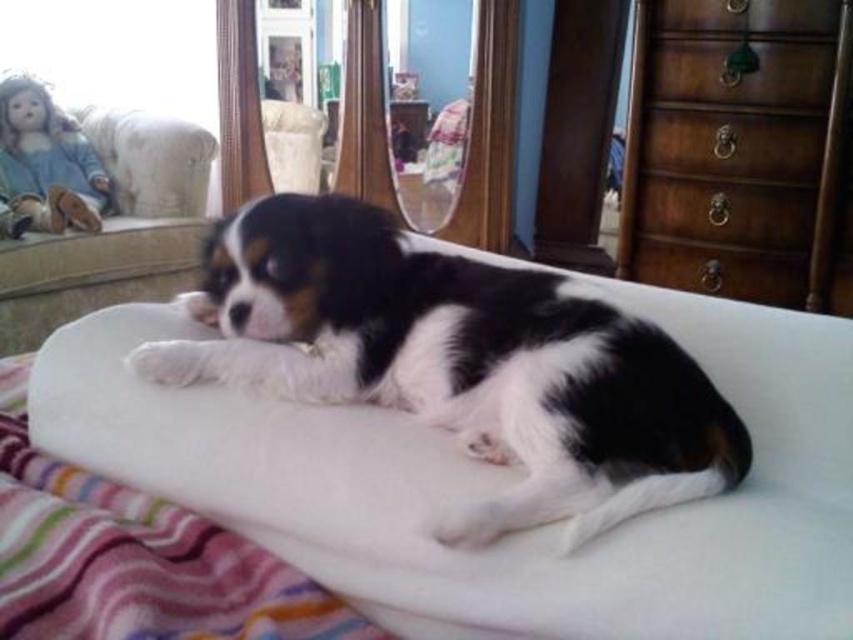
Question: Among these points, which one is nearest to the camera?

Choices:
 (A) (160, 156)
 (B) (334, 609)
 (C) (809, 81)

Answer: (B)

Question: In this image, where is dark brown wood drawer at upper right located relative to wooden drawer at upper right?

Choices:
 (A) left
 (B) right

Answer: (B)

Question: Which of the following is the closest to the observer?

Choices:
 (A) white fluffy blanket at center
 (B) black and white fur at center
 (C) white fabric armchair at upper center
 (D) wooden dresser at right

Answer: (A)

Question: Which of the following is the farthest from the observer?

Choices:
 (A) black and white fur at center
 (B) wooden dresser at right
 (C) white fabric couch at upper center

Answer: (C)

Question: Considering the relative positions of black and white fur at center and wooden drawer at upper right in the image provided, where is black and white fur at center located with respect to wooden drawer at upper right?

Choices:
 (A) below
 (B) above

Answer: (A)

Question: Is white fluffy blanket at center to the right of white fabric armchair at upper center from the viewer's perspective?

Choices:
 (A) no
 (B) yes

Answer: (B)